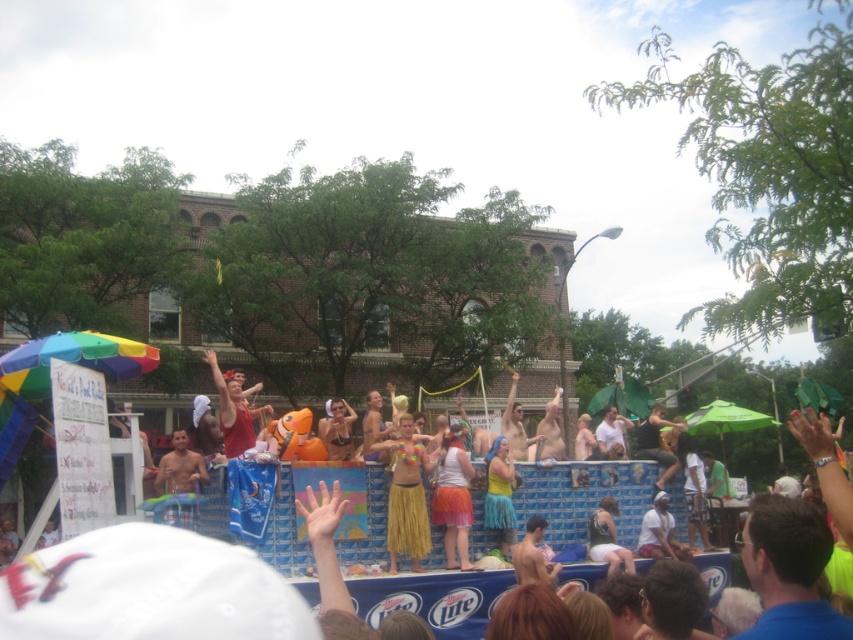
Who is more distant from viewer, (405, 472) or (448, 435)?

The point (448, 435) is behind.

Consider the image. Which of these two, yellow grass skirt at center or orange fabric skirt at center, stands taller?

yellow grass skirt at center is taller.

In order to click on yellow grass skirt at center in this screenshot , I will do `click(407, 496)`.

Find the location of `yellow grass skirt at center`. yellow grass skirt at center is located at coordinates (407, 496).

Does orange fabric skirt at center appear on the right side of red fabric shirt at center?

Yes, orange fabric skirt at center is to the right of red fabric shirt at center.

Who is taller, orange fabric skirt at center or red fabric shirt at center?

With more height is red fabric shirt at center.

This screenshot has width=853, height=640. I want to click on orange fabric skirt at center, so click(453, 497).

Where is `orange fabric skirt at center`? The image size is (853, 640). orange fabric skirt at center is located at coordinates (453, 497).

Which of these two, yellow grass skirt at center or red fabric shirt at center, stands shorter?

yellow grass skirt at center is shorter.

Between yellow grass skirt at center and red fabric shirt at center, which one appears on the right side from the viewer's perspective?

yellow grass skirt at center

Describe the element at coordinates (407, 496) in the screenshot. I see `yellow grass skirt at center` at that location.

At what (x,y) coordinates should I click in order to perform the action: click on yellow grass skirt at center. Please return your answer as a coordinate pair (x, y). Looking at the image, I should click on (407, 496).